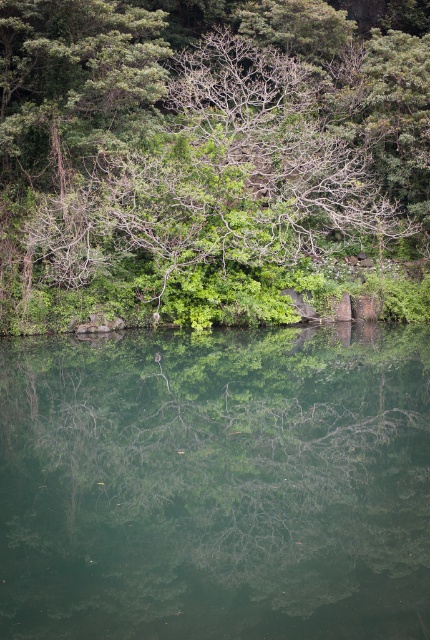
Question: Is green reflective water at center bigger than green leafy tree at center?

Choices:
 (A) yes
 (B) no

Answer: (B)

Question: Does green reflective water at center appear on the right side of green leafy tree at center?

Choices:
 (A) no
 (B) yes

Answer: (A)

Question: Does green reflective water at center have a lesser width compared to green leafy tree at center?

Choices:
 (A) yes
 (B) no

Answer: (A)